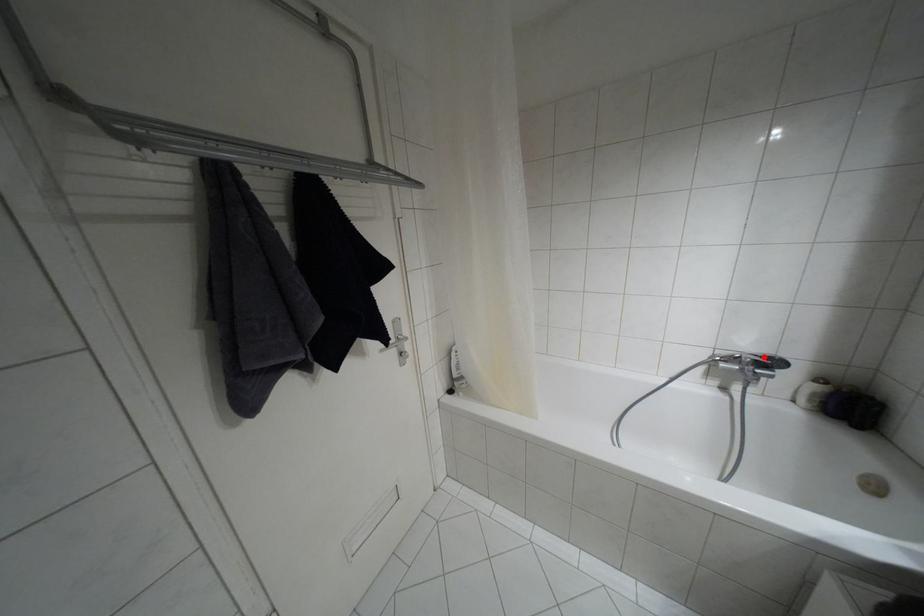
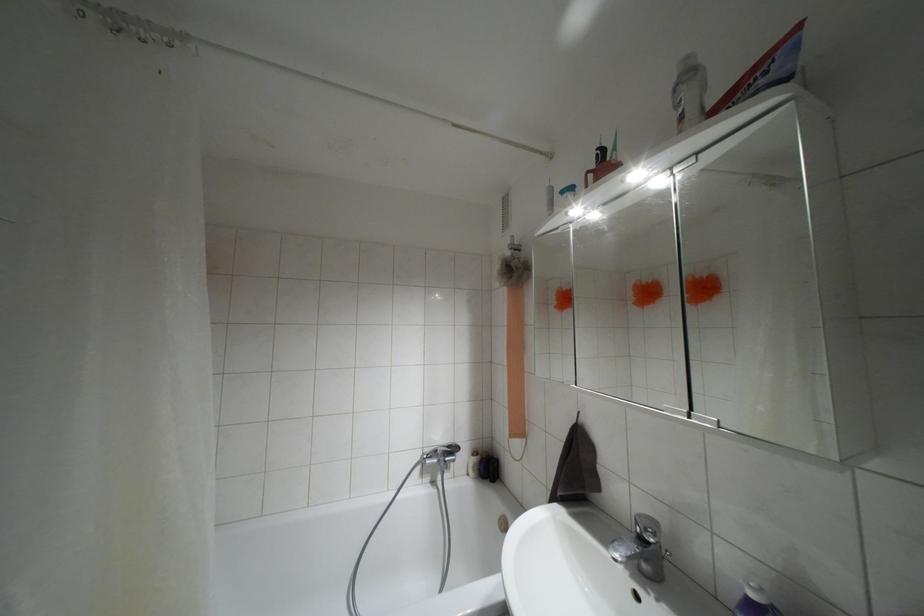
Question: I am providing you with two images of the same scene from different viewpoints. In image1, a red point is highlighted. Considering the same 3D point in image2, which of the following is correct?

Choices:
 (A) It is closer
 (B) It is farther

Answer: (B)